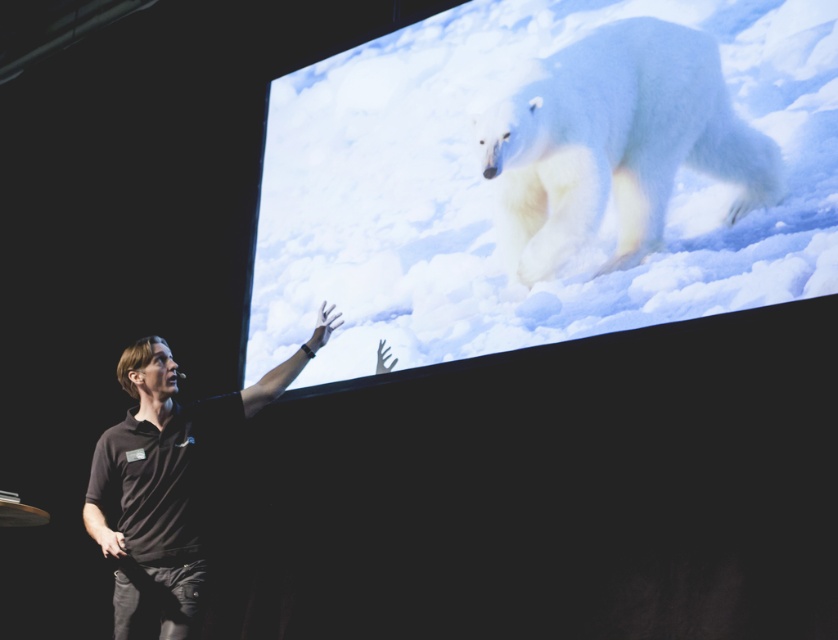
Question: Which object appears farthest from the camera in this image?

Choices:
 (A) white fluffy polar bear at upper right
 (B) black cotton shirt at lower left

Answer: (A)

Question: In this image, where is white fur polar bear at upper center located relative to black cotton shirt at lower left?

Choices:
 (A) above
 (B) below

Answer: (A)

Question: Which point is farther from the camera taking this photo?

Choices:
 (A) pyautogui.click(x=552, y=280)
 (B) pyautogui.click(x=711, y=65)
 (C) pyautogui.click(x=236, y=413)

Answer: (A)

Question: Is white fluffy polar bear at upper right positioned behind black cotton shirt at lower left?

Choices:
 (A) yes
 (B) no

Answer: (A)

Question: Which point is closer to the camera?

Choices:
 (A) white fluffy polar bear at upper right
 (B) black cotton shirt at lower left

Answer: (B)

Question: Is white fur polar bear at upper center bigger than white fluffy polar bear at upper right?

Choices:
 (A) no
 (B) yes

Answer: (B)